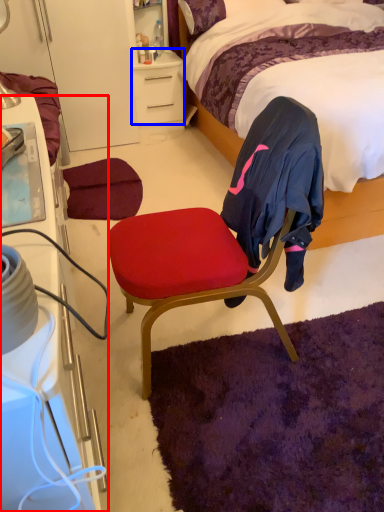
Question: Which object appears closest to the camera in this image, cabinetry (highlighted by a red box) or desk (highlighted by a blue box)?

Choices:
 (A) cabinetry
 (B) desk

Answer: (A)